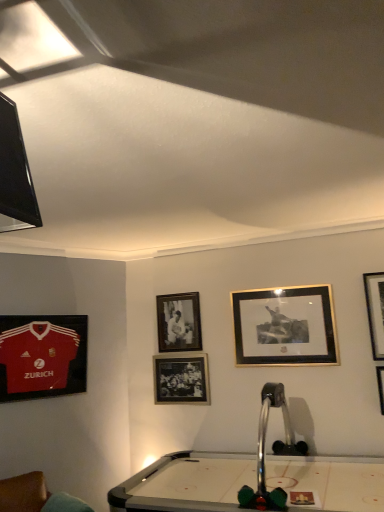
Image resolution: width=384 pixels, height=512 pixels. Identify the location of vacant point above matte jersey at left, positioned as the first picture frame in left-to-right order (from a real-world perspective). (45, 316).